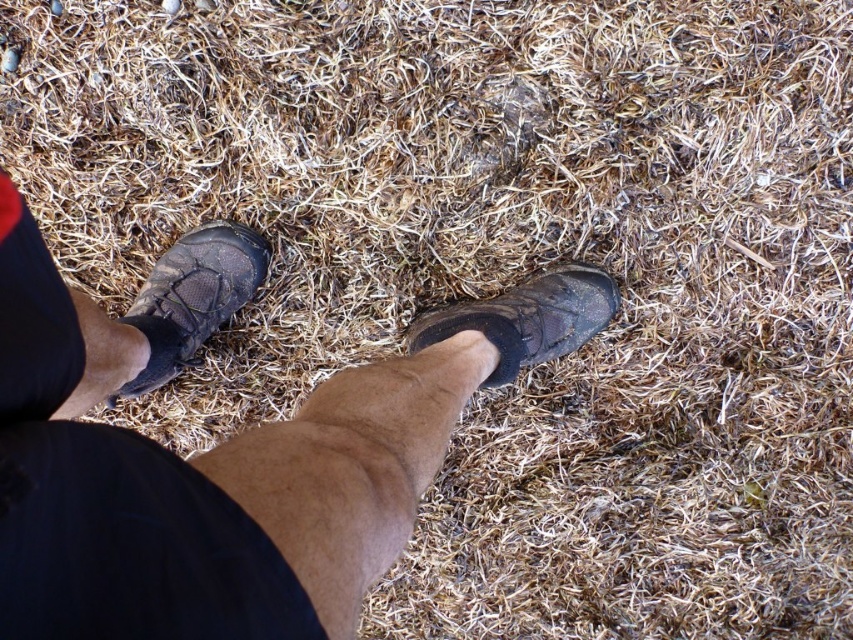
Question: From the image, what is the correct spatial relationship of matte black shoe at left in relation to leather boot at center?

Choices:
 (A) below
 (B) above

Answer: (B)

Question: Which point is farther to the camera?

Choices:
 (A) (194, 348)
 (B) (517, 326)

Answer: (A)

Question: Which object is farther from the camera taking this photo?

Choices:
 (A) matte black shoe at left
 (B) leather boot at center

Answer: (A)

Question: Is matte black shoe at left to the left of leather boot at center from the viewer's perspective?

Choices:
 (A) yes
 (B) no

Answer: (A)

Question: Is matte black shoe at left to the left of leather boot at center from the viewer's perspective?

Choices:
 (A) no
 (B) yes

Answer: (B)

Question: Which of the following is the farthest from the observer?

Choices:
 (A) leather boot at center
 (B) matte black shoe at left

Answer: (B)